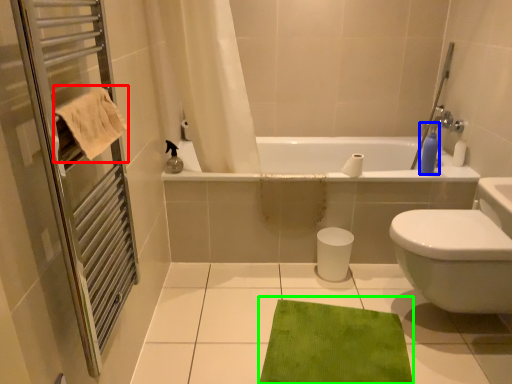
Question: Which object is positioned closest to beach towel (highlighted by a red box)? Select from soap dispenser (highlighted by a blue box) and bath mat (highlighted by a green box).

Choices:
 (A) soap dispenser
 (B) bath mat

Answer: (B)